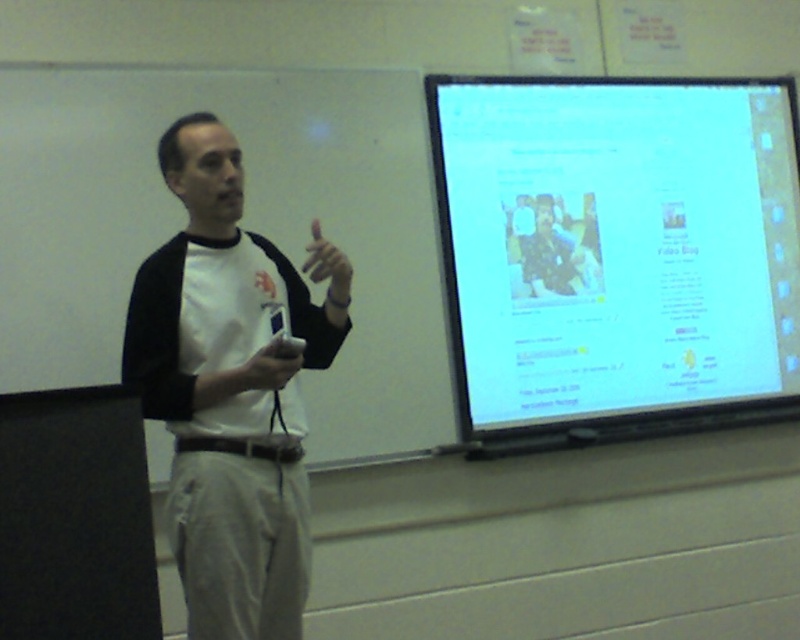
You are a student in the classroom and you need to reach both the white glossy screen at upper right and the white matte game controller at center. Which object is taller?

The white glossy screen at upper right is much taller than the white matte game controller at center.

You are a student sitting in the classroom and want to hand in your assignment to the professor. The professor is standing near the white matte game controller at center. You are currently near the white glossy screen at upper right. Which direction should you move to reach the professor?

You should move downward because the white glossy screen at upper right is further to the viewer than the white matte game controller at center, meaning the professor is located below your current position.